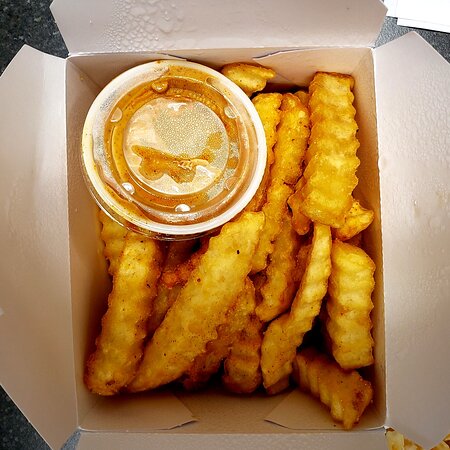
Where is `box`? The width and height of the screenshot is (450, 450). box is located at coordinates (38, 299).